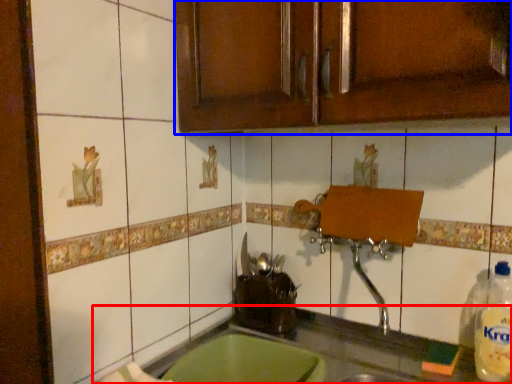
Question: Which point is further to the camera, countertop (highlighted by a red box) or cabinetry (highlighted by a blue box)?

Choices:
 (A) countertop
 (B) cabinetry

Answer: (B)